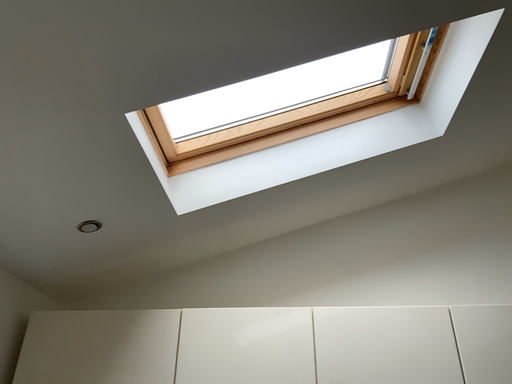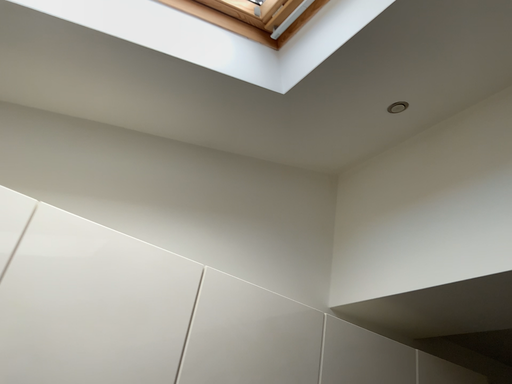
Question: Which way did the camera rotate in the video?

Choices:
 (A) rotated left
 (B) rotated right

Answer: (B)